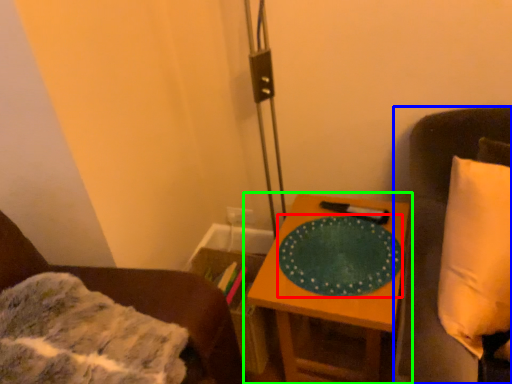
Question: Which object is positioned farthest from platter (highlighted by a red box)? Select from furniture (highlighted by a blue box) and table (highlighted by a green box).

Choices:
 (A) furniture
 (B) table

Answer: (A)